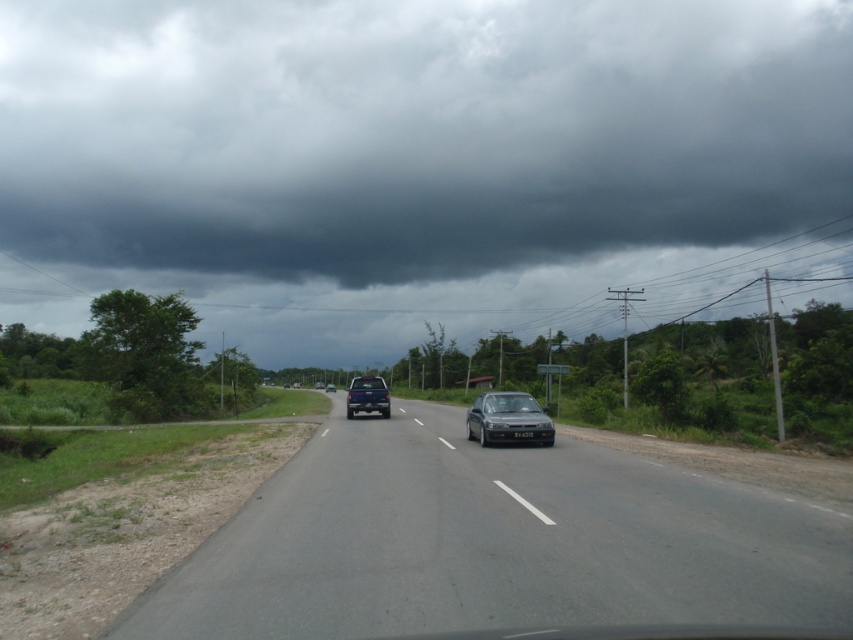
Question: Is asphalt road at lower left bigger than satin silver sedan at center?

Choices:
 (A) yes
 (B) no

Answer: (A)

Question: Is satin silver sedan at center to the left of blue metallic truck at center from the viewer's perspective?

Choices:
 (A) no
 (B) yes

Answer: (A)

Question: Is metallic blue truck at center wider than blue metallic truck at center?

Choices:
 (A) no
 (B) yes

Answer: (A)

Question: Which is nearer to the satin silver sedan at center?

Choices:
 (A) metallic blue truck at center
 (B) dark gray cloud at upper center
 (C) blue metallic truck at center

Answer: (A)

Question: Which object appears closest to the camera in this image?

Choices:
 (A) satin silver sedan at center
 (B) blue metallic truck at center
 (C) asphalt road at lower left
 (D) metallic blue truck at center

Answer: (C)

Question: Considering the real-world distances, which object is closest to the asphalt road at lower left?

Choices:
 (A) dark gray cloud at upper center
 (B) blue metallic truck at center
 (C) satin silver sedan at center

Answer: (C)